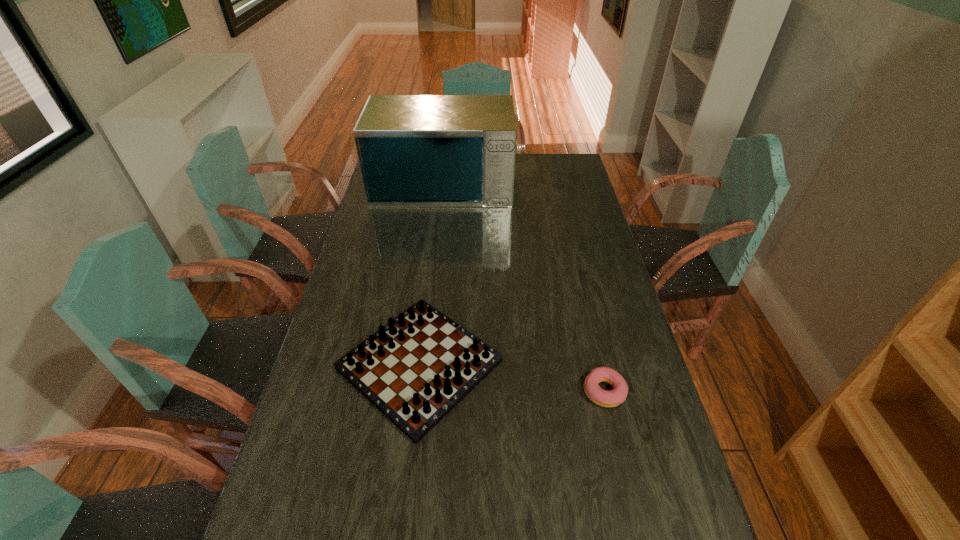
Locate an element on the screen. This screenshot has width=960, height=540. the tallest object is located at coordinates (414, 150).

You are a GUI agent. You are given a task and a screenshot of the screen. Output one action in this format:
    pyautogui.click(x=<x>, y=<y>)
    Task: Click on the farthest object
    This screenshot has width=960, height=540.
    Given the screenshot: What is the action you would take?
    pyautogui.click(x=414, y=150)

You are a GUI agent. You are given a task and a screenshot of the screen. Output one action in this format:
    pyautogui.click(x=<x>, y=<y>)
    Task: Click on the chessboard
    This screenshot has height=540, width=960.
    Given the screenshot: What is the action you would take?
    pyautogui.click(x=417, y=368)

Locate an element on the screen. This screenshot has height=540, width=960. doughnut is located at coordinates (604, 398).

Identify the location of the shortest object. The image size is (960, 540). (604, 398).

The height and width of the screenshot is (540, 960). Identify the location of vacant region located on the front-facing side of the farthest object. (437, 241).

Where is `free location located on the back of the second shortest object`? The height and width of the screenshot is (540, 960). free location located on the back of the second shortest object is located at coordinates (436, 233).

I want to click on free spot located 0.330m on the left of the doughnut, so click(458, 391).

Image resolution: width=960 pixels, height=540 pixels. I want to click on object present at the far edge, so click(x=414, y=150).

At what (x,y) coordinates should I click in order to perform the action: click on microwave oven located in the left edge section of the desktop. Please return your answer as a coordinate pair (x, y). Looking at the image, I should click on (414, 150).